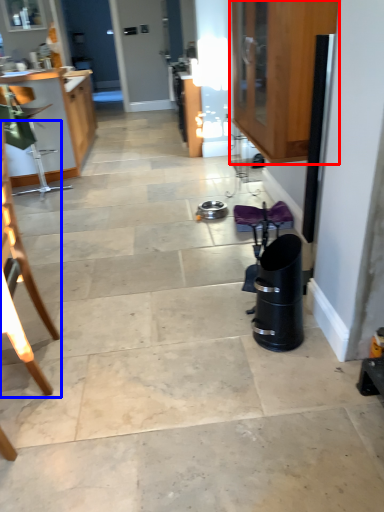
Question: Which of the following is the closest to the observer, cabinetry (highlighted by a red box) or chair (highlighted by a blue box)?

Choices:
 (A) cabinetry
 (B) chair

Answer: (B)